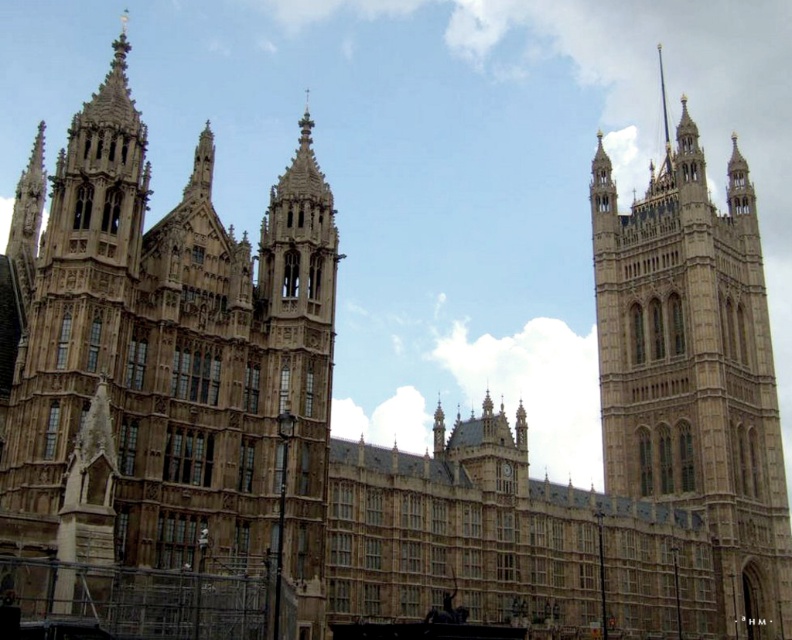
You are an architect analyzing the Palace of Westminster. You notice two towers in the image. Based on their widths, which tower would require more materials to construct between the brown stone tower at left and the beige stone tower at right?

The brown stone tower at left requires more materials because its width is larger than the beige stone tower at right.

You are a tourist standing in front of the Palace of Westminster. You notice two towers in the image. The brown stone tower at left and the beige stone tower at right. Which tower is positioned higher up in the image?

The brown stone tower at left is located above the beige stone tower at right, so it is positioned higher up in the image.